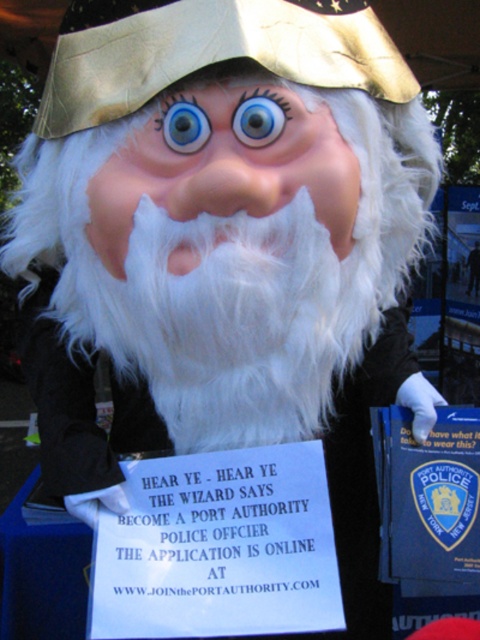
Is white paper sign at center to the right of blue glossy eye at center from the viewer's perspective?

Incorrect, white paper sign at center is not on the right side of blue glossy eye at center.

What do you see at coordinates (217, 547) in the screenshot? I see `white paper sign at center` at bounding box center [217, 547].

Find the location of a particular element. white paper sign at center is located at coordinates (217, 547).

Is white paper sign at center to the left of blue glossy eye at upper center from the viewer's perspective?

No, white paper sign at center is not to the left of blue glossy eye at upper center.

Is point (332, 582) closer to camera compared to point (188, 104)?

No, it is not.

Locate an element on the screen. white paper sign at center is located at coordinates (217, 547).

Does blue glossy eye at center lie in front of blue glossy eye at upper center?

Yes, blue glossy eye at center is in front of blue glossy eye at upper center.

Can you confirm if blue glossy eye at center is positioned to the right of blue glossy eye at upper center?

Correct, you'll find blue glossy eye at center to the right of blue glossy eye at upper center.

Where is `blue glossy eye at center`? This screenshot has height=640, width=480. blue glossy eye at center is located at coordinates (260, 118).